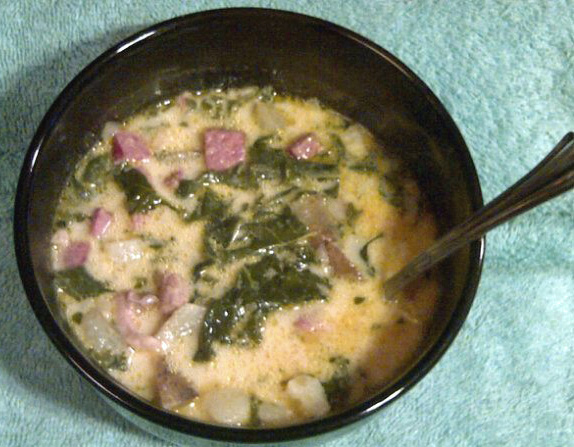
Locate an element on the screen. Image resolution: width=574 pixels, height=447 pixels. spoon is located at coordinates (545, 187).